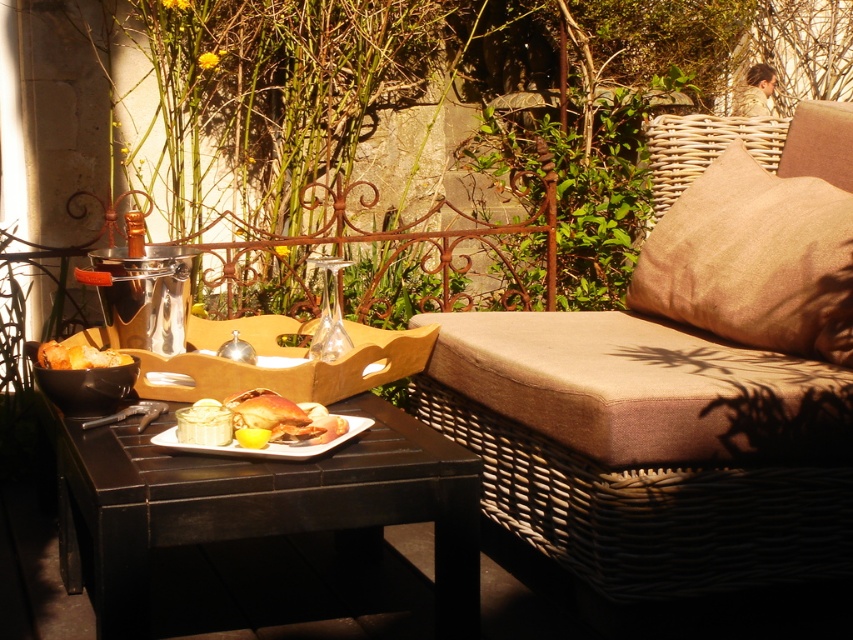
You are a photographer standing at the camera position. You want to take a closeup photo of the shiny silver crab at center. Can you reach it without moving your feet? The minimum focusing distance of your camera is 6 feet.

The shiny silver crab at center is 5.89 feet away from the camera, which is within the minimum focusing distance of 6 feet. Therefore, you can take the closeup photo without moving your feet.